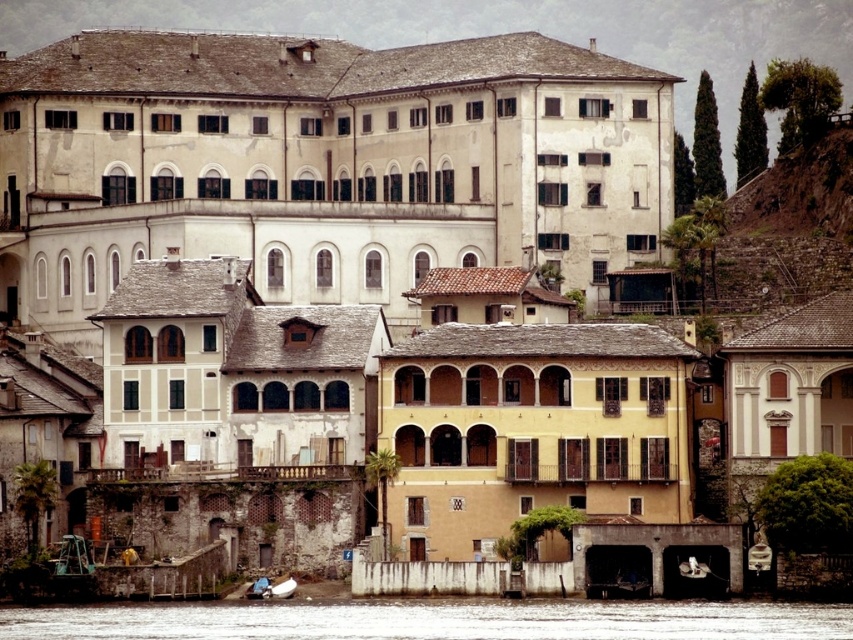
Question: Which object is closer to the camera taking this photo?

Choices:
 (A) blue fabric boat at lower center
 (B) white glossy boat at lower center

Answer: (B)

Question: Is clear water at lower center further to camera compared to white glossy boat at lower center?

Choices:
 (A) yes
 (B) no

Answer: (B)

Question: Which object is farther from the camera taking this photo?

Choices:
 (A) brown rocky hillside at upper right
 (B) white glossy boat at lower center
 (C) clear water at lower center

Answer: (A)

Question: Which of the following is the farthest from the observer?

Choices:
 (A) blue fabric boat at lower center
 (B) white glossy boat at lower center
 (C) brown rocky hillside at upper right
 (D) clear water at lower center

Answer: (C)

Question: Is white glossy boat at lower center bigger than blue fabric boat at lower center?

Choices:
 (A) yes
 (B) no

Answer: (A)

Question: Observing the image, what is the correct spatial positioning of clear water at lower center in reference to blue fabric boat at lower center?

Choices:
 (A) above
 (B) below

Answer: (A)